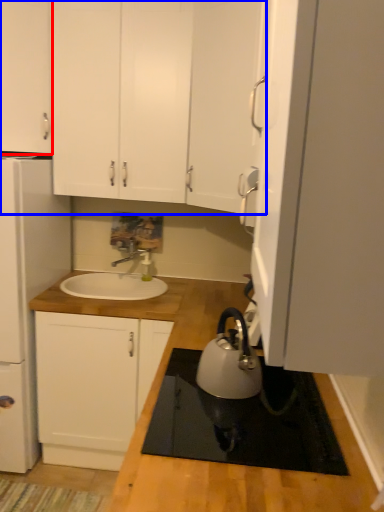
Question: Among these objects, which one is nearest to the camera, cabinetry (highlighted by a red box) or cabinetry (highlighted by a blue box)?

Choices:
 (A) cabinetry
 (B) cabinetry

Answer: (A)